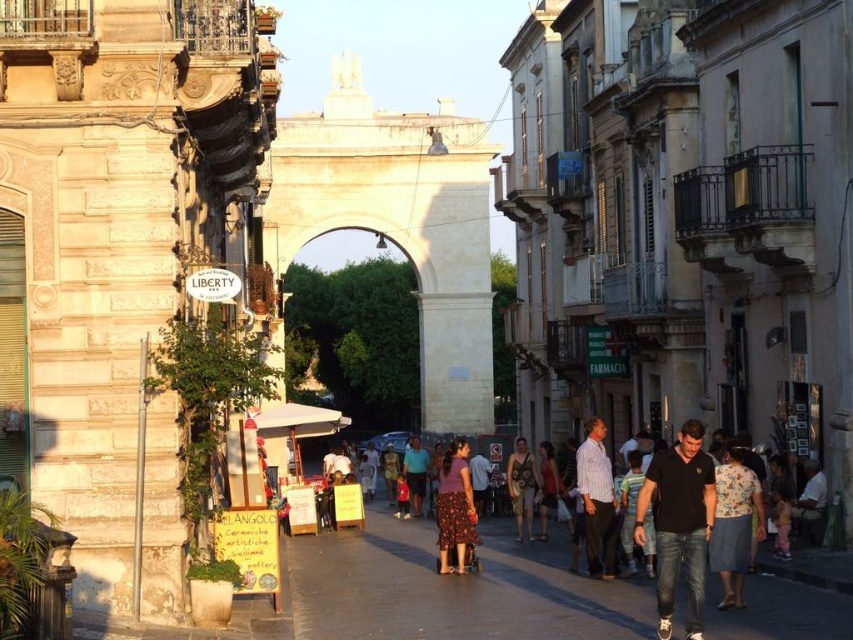
Question: Observing the image, what is the correct spatial positioning of smooth concrete sidewalk at center in reference to floral skirt at center?

Choices:
 (A) right
 (B) left

Answer: (B)

Question: Which of the following is the farthest from the observer?

Choices:
 (A) floral fabric dress at lower right
 (B) floral skirt at center
 (C) striped cotton shirt at center
 (D) gold textured dress at center

Answer: (D)

Question: Can you confirm if smooth concrete sidewalk at center is thinner than gold textured dress at center?

Choices:
 (A) no
 (B) yes

Answer: (A)

Question: Observing the image, what is the correct spatial positioning of smooth concrete sidewalk at center in reference to matte blue shirt at center?

Choices:
 (A) above
 (B) below

Answer: (A)

Question: Among these points, which one is farthest from the camera?

Choices:
 (A) (595, 420)
 (B) (529, 502)
 (C) (730, 564)
 (D) (560, 586)

Answer: (B)

Question: Which of the following is the closest to the observer?

Choices:
 (A) black cotton shirt at lower right
 (B) striped cotton shirt at center

Answer: (A)